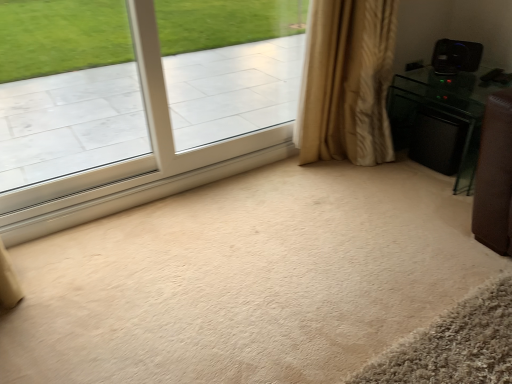
This screenshot has width=512, height=384. What do you see at coordinates (456, 56) in the screenshot?
I see `black plastic speaker at upper right` at bounding box center [456, 56].

At what (x,y) coordinates should I click in order to perform the action: click on black plastic speaker at upper right. Please return your answer as a coordinate pair (x, y). Looking at the image, I should click on (456, 56).

What do you see at coordinates (441, 112) in the screenshot? I see `black glossy speaker at right` at bounding box center [441, 112].

Identify the location of black plastic speaker at upper right. This screenshot has height=384, width=512. (456, 56).

Which of these two, black plastic speaker at upper right or beige textured curtain at right, is wider?

beige textured curtain at right is wider.

Which is less distant, (446,47) or (354,144)?

Point (446,47)

Image resolution: width=512 pixels, height=384 pixels. I want to click on speaker located above the beige textured curtain at right (from the image's perspective), so click(x=456, y=56).

Is the surface of black plastic speaker at upper right in direct contact with beige textured curtain at right?

black plastic speaker at upper right and beige textured curtain at right are clearly separated.

How many degrees apart are the facing directions of beige textured curtain at right and black glossy speaker at right?

87.6 degrees separate the facing orientations of beige textured curtain at right and black glossy speaker at right.

From a real-world perspective, is beige textured curtain at right under black glossy speaker at right?

Incorrect, from a real-world perspective, beige textured curtain at right is higher than black glossy speaker at right.

Which is farther from the camera, [322,145] or [452,103]?

The point [322,145] is farther from the camera.

Which is more to the right, beige textured curtain at right or black glossy speaker at right?

Positioned to the right is black glossy speaker at right.

Identify the location of window lying on the left of beige textured curtain at right. This screenshot has width=512, height=384. (141, 91).

From a real-world perspective, which is physically above, beige textured curtain at right or clear glass window at upper left?

In real-world perspective, clear glass window at upper left is above.

Is beige textured curtain at right to the left of clear glass window at upper left from the viewer's perspective?

In fact, beige textured curtain at right is to the right of clear glass window at upper left.

Where is `window in front of the beige textured curtain at right`? window in front of the beige textured curtain at right is located at coordinates (141, 91).

Does point (219, 91) come farther from viewer compared to point (361, 130)?

That is True.

From a real-world perspective, is clear glass window at upper left beneath beige textured curtain at right?

Incorrect, from a real-world perspective, clear glass window at upper left is higher than beige textured curtain at right.

Would you say black glossy speaker at right is a long distance from clear glass window at upper left?

Yes, black glossy speaker at right and clear glass window at upper left are located far from each other.

From the picture: Between black glossy speaker at right and clear glass window at upper left, which one has smaller size?

Smaller between the two is clear glass window at upper left.

Identify the location of furniture behind the clear glass window at upper left. (441, 112).

Can you confirm if black glossy speaker at right is positioned to the right of beige textured curtain at right?

Indeed, black glossy speaker at right is positioned on the right side of beige textured curtain at right.

How many degrees apart are the facing directions of black glossy speaker at right and beige textured curtain at right?

The angle between the facing direction of black glossy speaker at right and the facing direction of beige textured curtain at right is 87.6 degrees.

From the picture: Do you think black glossy speaker at right is within beige textured curtain at right, or outside of it?

black glossy speaker at right is not inside beige textured curtain at right, it's outside.

Which object is thinner, black glossy speaker at right or beige textured curtain at right?

With smaller width is beige textured curtain at right.

Do you think black glossy speaker at right is within black plastic speaker at upper right, or outside of it?

black glossy speaker at right exists outside the volume of black plastic speaker at upper right.

Is black glossy speaker at right oriented towards black plastic speaker at upper right?

No, black glossy speaker at right does not turn towards black plastic speaker at upper right.

Is point (426, 97) farther from camera compared to point (463, 64)?

Yes, point (426, 97) is behind point (463, 64).

Where is `speaker lying behind the beige textured curtain at right`? Image resolution: width=512 pixels, height=384 pixels. speaker lying behind the beige textured curtain at right is located at coordinates (456, 56).

Where is `furniture on the right of beige textured curtain at right`? This screenshot has width=512, height=384. furniture on the right of beige textured curtain at right is located at coordinates (441, 112).

When comparing their distances from black plastic speaker at upper right, does black glossy speaker at right or beige textured curtain at right seem closer?

Based on the image, black glossy speaker at right appears to be nearer to black plastic speaker at upper right.

Considering their positions, is beige textured curtain at right positioned closer to clear glass window at upper left than black glossy speaker at right?

beige textured curtain at right is positioned closer to the anchor clear glass window at upper left.

Based on their spatial positions, is beige textured curtain at right or clear glass window at upper left closer to black glossy speaker at right?

Among the two, beige textured curtain at right is located nearer to black glossy speaker at right.

Based on the photo, which object lies nearer to the anchor point black glossy speaker at right, black plastic speaker at upper right or clear glass window at upper left?

Based on the image, black plastic speaker at upper right appears to be nearer to black glossy speaker at right.

Based on their spatial positions, is beige textured curtain at right or clear glass window at upper left closer to black plastic speaker at upper right?

beige textured curtain at right.

Looking at the image, which one is located further to black glossy speaker at right, clear glass window at upper left or black plastic speaker at upper right?

clear glass window at upper left.

In the scene shown: When comparing their distances from clear glass window at upper left, does black plastic speaker at upper right or black glossy speaker at right seem further?

black plastic speaker at upper right is positioned further to the anchor clear glass window at upper left.

Estimate the real-world distances between objects in this image. Which object is closer to black plastic speaker at upper right, black glossy speaker at right or clear glass window at upper left?

black glossy speaker at right lies closer to black plastic speaker at upper right than the other object.

This screenshot has width=512, height=384. I want to click on curtain between clear glass window at upper left and black glossy speaker at right, so click(x=348, y=82).

The height and width of the screenshot is (384, 512). In order to click on curtain between clear glass window at upper left and black plastic speaker at upper right in the horizontal direction in this screenshot , I will do `click(348, 82)`.

Locate an element on the screen. This screenshot has width=512, height=384. furniture between clear glass window at upper left and black plastic speaker at upper right from left to right is located at coordinates (441, 112).

Locate an element on the screen. Image resolution: width=512 pixels, height=384 pixels. furniture situated between beige textured curtain at right and black plastic speaker at upper right from left to right is located at coordinates (441, 112).